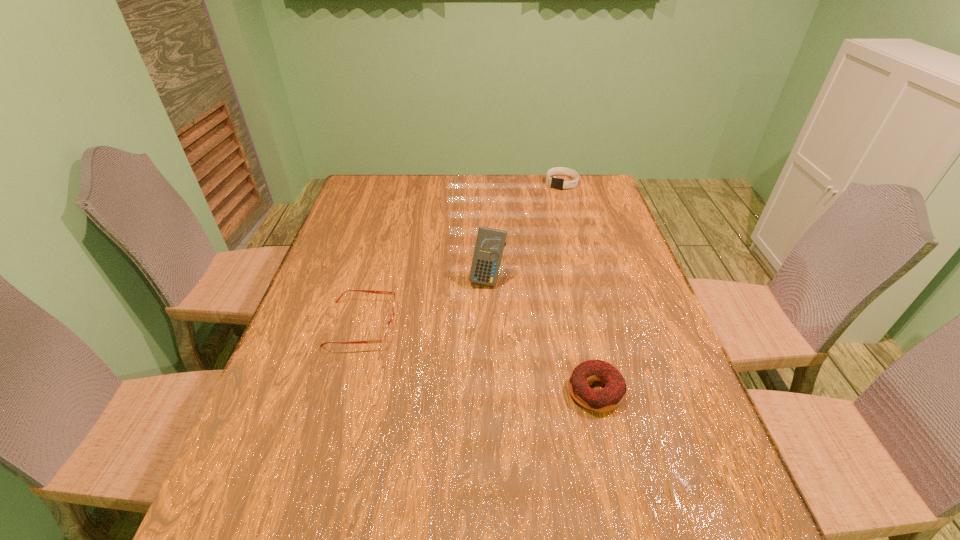
Locate an element on the screen. The image size is (960, 540). the third farthest object is located at coordinates (388, 331).

This screenshot has width=960, height=540. Find the location of `spectacles`. spectacles is located at coordinates (388, 331).

The image size is (960, 540). I want to click on the nearest object, so click(608, 398).

What are the coordinates of `the third object from right to left` in the screenshot? It's located at (490, 243).

Locate an element on the screen. The image size is (960, 540). the third nearest object is located at coordinates (490, 243).

You are a GUI agent. You are given a task and a screenshot of the screen. Output one action in this format:
    pyautogui.click(x=<x>, y=<y>)
    Task: Click on the wristband
    
    Given the screenshot: What is the action you would take?
    pyautogui.click(x=557, y=183)

Image resolution: width=960 pixels, height=540 pixels. In order to click on vacant region located on the lenses of the spectacles in this screenshot , I will do `click(440, 323)`.

The height and width of the screenshot is (540, 960). Identify the location of vacant space located on the right of the nearest object. (692, 392).

Image resolution: width=960 pixels, height=540 pixels. What are the coordinates of `vacant position located 0.340m on the front-facing side of the tallest object` in the screenshot? It's located at (460, 393).

This screenshot has height=540, width=960. What are the coordinates of `vacant area located 0.110m on the front-facing side of the tallest object` in the screenshot? It's located at (478, 318).